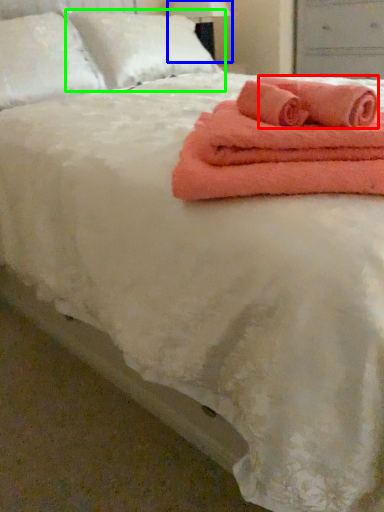
Question: Which is nearer to the bath towel (highlighted by a red box)? bedside lamp (highlighted by a blue box) or pillow (highlighted by a green box).

Choices:
 (A) bedside lamp
 (B) pillow

Answer: (B)